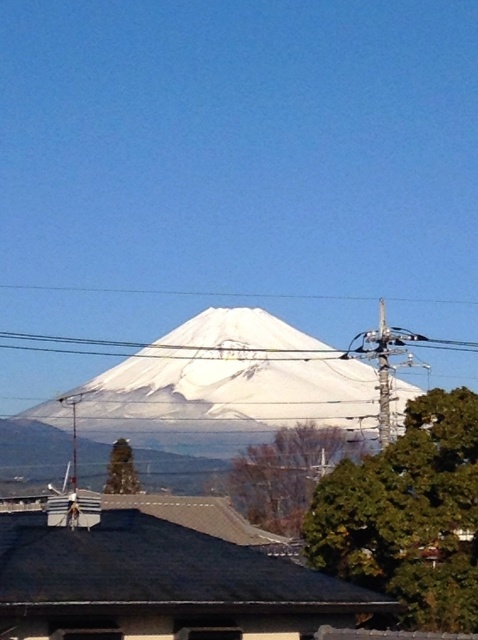
Between point (189, 353) and point (466, 346), which one is positioned behind?

Positioned behind is point (466, 346).

Can you confirm if white snow-covered mountain peak at center is bigger than white plastic power line at center?

Indeed, white snow-covered mountain peak at center has a larger size compared to white plastic power line at center.

Which is behind, point (46, 410) or point (348, 352)?

Point (46, 410)

Where is `white snow-covered mountain peak at center`? The width and height of the screenshot is (478, 640). white snow-covered mountain peak at center is located at coordinates (231, 381).